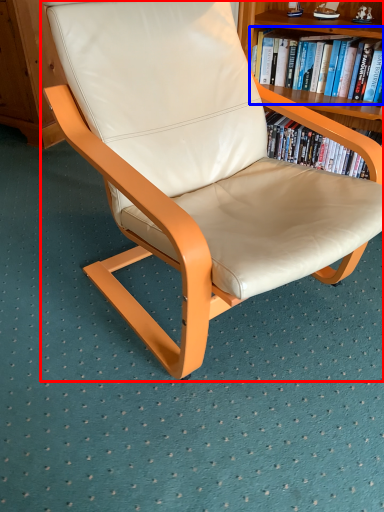
Question: Which object appears farthest to the camera in this image, chair (highlighted by a red box) or book (highlighted by a blue box)?

Choices:
 (A) chair
 (B) book

Answer: (B)